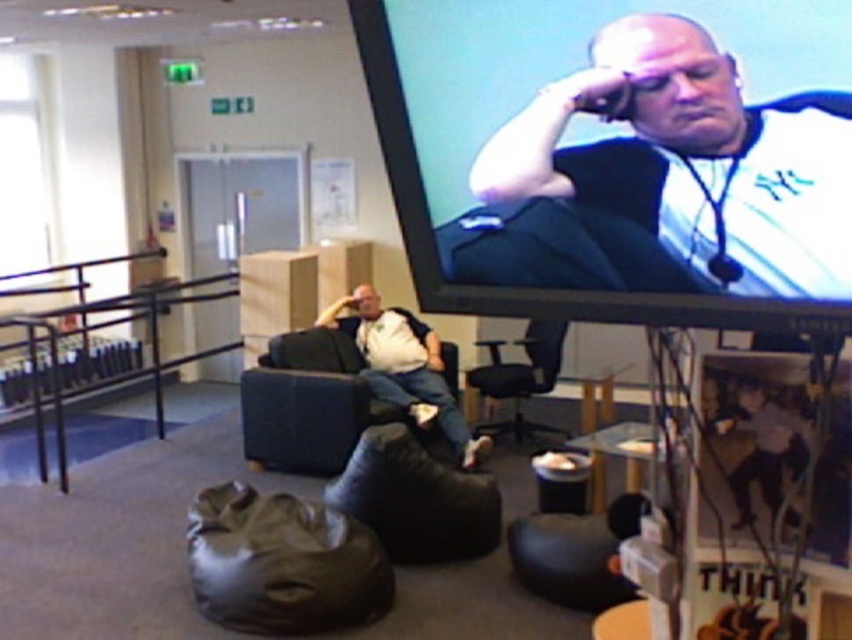
Can you confirm if matte black jacket at upper right is wider than white matte shirt at center?

No.

Who is positioned more to the right, matte black jacket at upper right or white matte shirt at center?

Positioned to the right is matte black jacket at upper right.

The width and height of the screenshot is (852, 640). I want to click on matte black jacket at upper right, so [x=666, y=177].

I want to click on matte black jacket at upper right, so click(666, 177).

In the scene shown: Does matte black jacket at upper right have a greater height compared to black fabric armchair at center?

No.

Can you confirm if matte black jacket at upper right is bigger than black fabric armchair at center?

Incorrect, matte black jacket at upper right is not larger than black fabric armchair at center.

The image size is (852, 640). In order to click on matte black jacket at upper right in this screenshot , I will do `click(666, 177)`.

At what (x,y) coordinates should I click in order to perform the action: click on matte black jacket at upper right. Please return your answer as a coordinate pair (x, y). Looking at the image, I should click on (666, 177).

Between point (240, 592) and point (534, 348), which one is positioned behind?

Positioned behind is point (534, 348).

Is dark brown leather bean bag at lower center thinner than black fabric armchair at center?

In fact, dark brown leather bean bag at lower center might be wider than black fabric armchair at center.

Who is more forward, [232,624] or [476,394]?

Point [232,624]

I want to click on dark brown leather bean bag at lower center, so click(x=281, y=563).